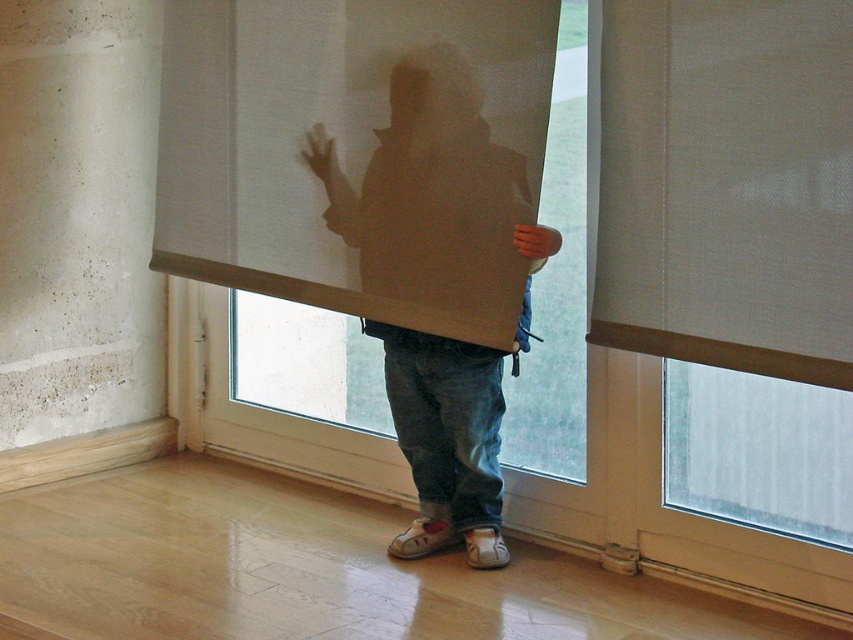
Question: Does white sheer curtain at center have a larger size compared to matte cardboard box at center?

Choices:
 (A) yes
 (B) no

Answer: (A)

Question: Observing the image, what is the correct spatial positioning of white sheer curtain at center in reference to matte cardboard box at center?

Choices:
 (A) below
 (B) above

Answer: (B)

Question: Which point is farther from the camera taking this photo?

Choices:
 (A) (790, 282)
 (B) (334, 12)

Answer: (B)

Question: Among these objects, which one is farthest from the camera?

Choices:
 (A) white sheer curtain at center
 (B) beige fabric curtain at upper right
 (C) matte cardboard box at center

Answer: (C)

Question: Which point is farther to the camera?

Choices:
 (A) (645, 179)
 (B) (515, 248)
 (C) (445, 257)

Answer: (C)

Question: Is white sheer curtain at center smaller than beige fabric curtain at upper right?

Choices:
 (A) no
 (B) yes

Answer: (A)